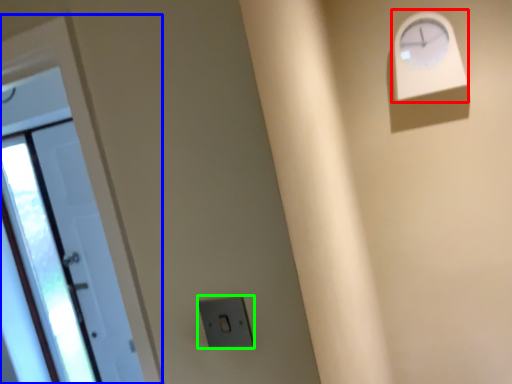
Question: Estimate the real-world distances between objects in this image. Which object is closer to clock (highlighted by a red box), door (highlighted by a blue box) or electric outlet (highlighted by a green box)?

Choices:
 (A) door
 (B) electric outlet

Answer: (B)